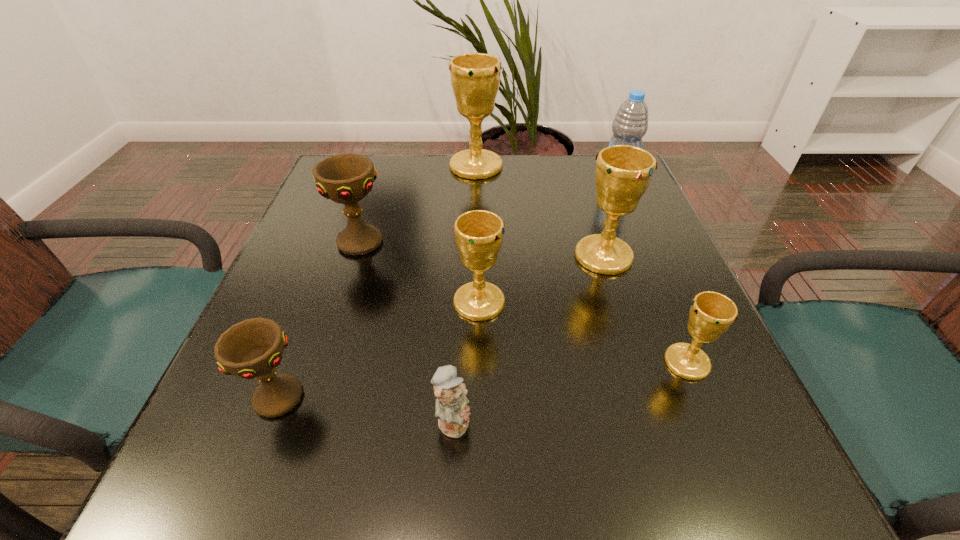
Locate an element on the screen. vacant space at the far right corner is located at coordinates (581, 188).

This screenshot has width=960, height=540. I want to click on vacant space in between the water bottle and the nearest gold chalice, so click(652, 273).

Find the location of a particular element. This screenshot has height=540, width=960. vacant space in between the smaller red chalice and the biggest gold chalice is located at coordinates (377, 281).

The width and height of the screenshot is (960, 540). I want to click on free space between the farthest gold chalice and the farther red chalice, so click(418, 204).

Find the location of a particular element. This screenshot has height=540, width=960. vacant point located between the second tallest chalice and the third farthest gold chalice is located at coordinates click(x=541, y=279).

I want to click on free spot between the second biggest gold chalice and the shortest object, so click(528, 338).

Identify the location of free area in between the water bottle and the teddy bear. The width and height of the screenshot is (960, 540). (535, 301).

This screenshot has height=540, width=960. Find the location of `empty space that is in between the shortest object and the water bottle`. empty space that is in between the shortest object and the water bottle is located at coordinates (535, 301).

This screenshot has width=960, height=540. What are the coordinates of `unoccupied position between the smaller red chalice and the farthest chalice` in the screenshot? It's located at (377, 281).

Image resolution: width=960 pixels, height=540 pixels. I want to click on vacant point located between the smallest gold chalice and the fourth nearest object, so click(583, 332).